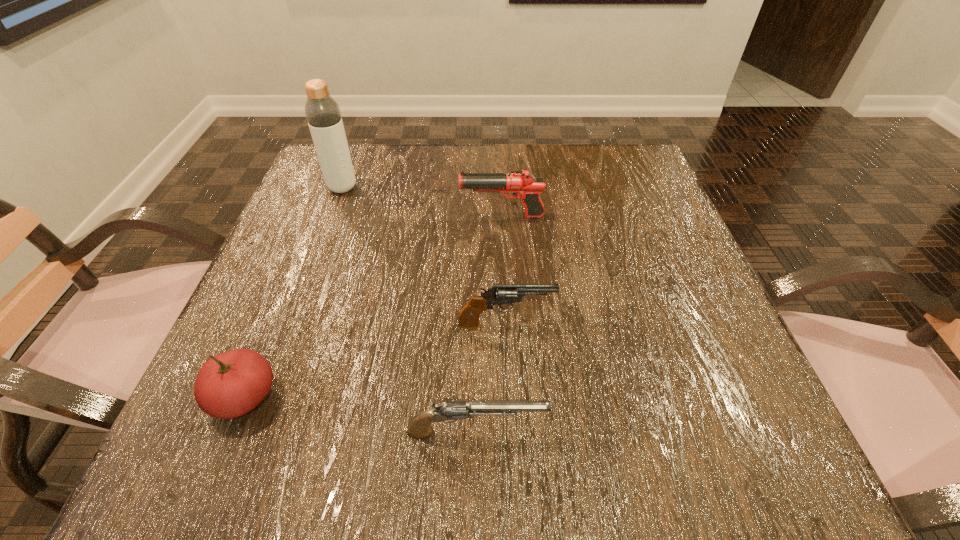
You are a GUI agent. You are given a task and a screenshot of the screen. Output one action in this format:
    pyautogui.click(x=<x>, y=<y>)
    Task: Click on the vacant space located at the aiming end of the farthest gun
    
    Given the screenshot: What is the action you would take?
    pyautogui.click(x=341, y=216)

Locate an element on the screen. This screenshot has width=960, height=540. vacant area located along the barrel of the third nearest object is located at coordinates (643, 324).

You are a GUI agent. You are given a task and a screenshot of the screen. Output one action in this format:
    pyautogui.click(x=<x>, y=<y>)
    Task: Click on the free location located on the back of the tomato
    Image resolution: width=960 pixels, height=540 pixels.
    Given the screenshot: What is the action you would take?
    pyautogui.click(x=299, y=266)

Identify the location of vacant space positioned 0.210m aiming along the barrel of the shortest gun. This screenshot has width=960, height=540. (700, 432).

The image size is (960, 540). Identify the location of object that is at the far edge. (323, 115).

Locate an element on the screen. This screenshot has width=960, height=540. tomato at the near edge is located at coordinates (231, 384).

This screenshot has height=540, width=960. I want to click on gun situated at the near edge, so click(x=448, y=411).

Where is `bottle located at the left edge`? The height and width of the screenshot is (540, 960). bottle located at the left edge is located at coordinates (323, 115).

What are the coordinates of `tomato located at the left edge` in the screenshot? It's located at (231, 384).

The width and height of the screenshot is (960, 540). I want to click on object present at the far left corner, so click(x=323, y=115).